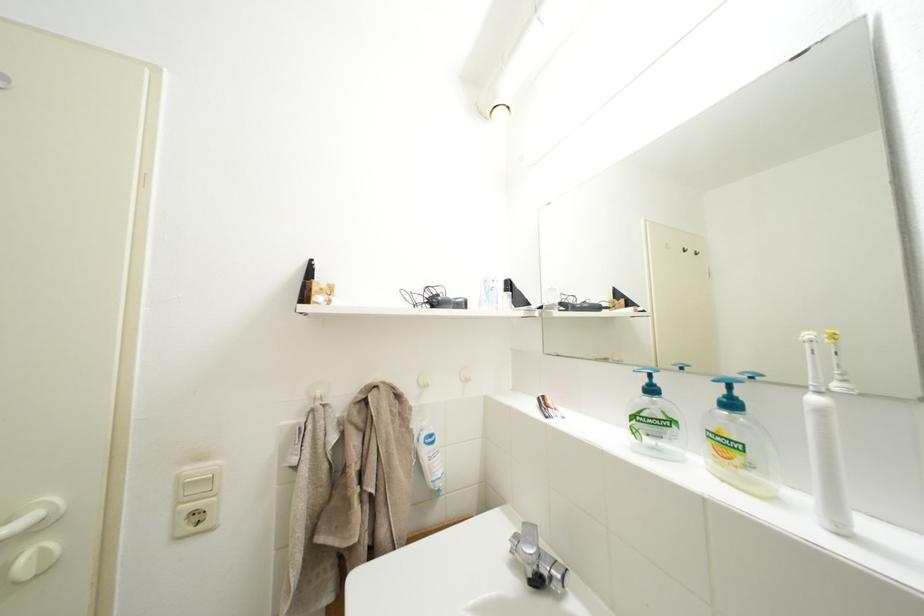
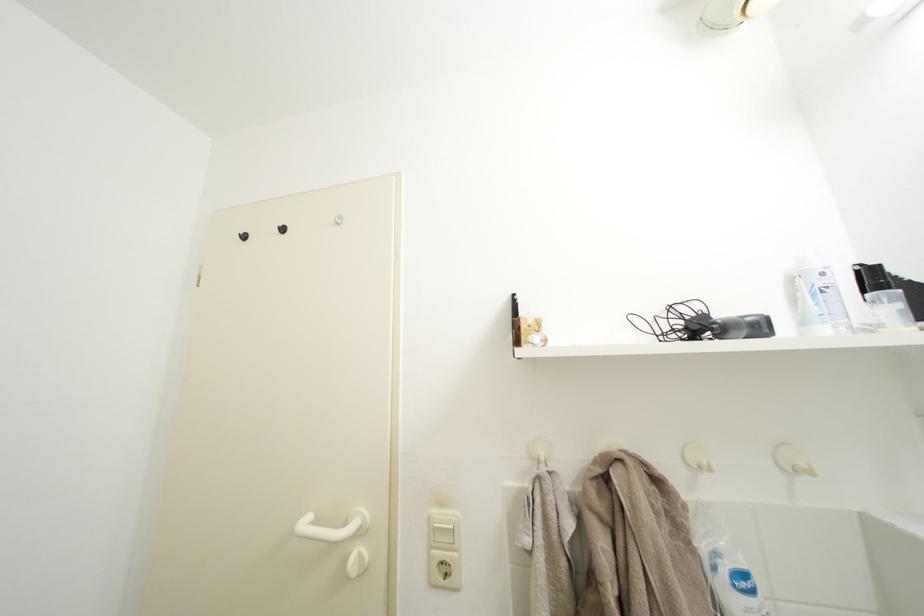
In the second image, find the point that corresponds to (x=519, y=305) in the first image.

(910, 310)